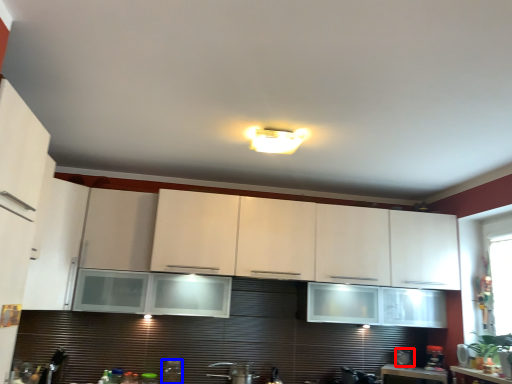
Question: Which point is further to the camera, appliance (highlighted by a red box) or appliance (highlighted by a blue box)?

Choices:
 (A) appliance
 (B) appliance

Answer: (A)